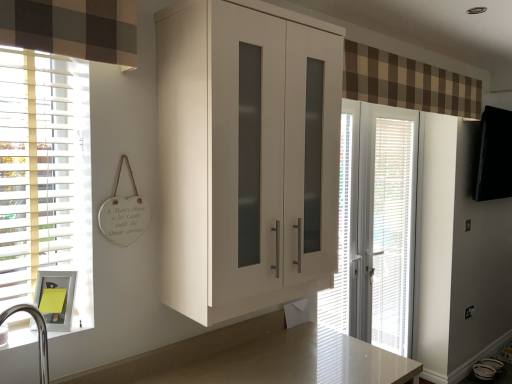
Question: Considering the relative sizes of white glossy door at center and white glossy medicine cabinet at lower left in the image provided, is white glossy door at center wider than white glossy medicine cabinet at lower left?

Choices:
 (A) no
 (B) yes

Answer: (A)

Question: Is white glossy door at center aimed at white glossy medicine cabinet at lower left?

Choices:
 (A) no
 (B) yes

Answer: (A)

Question: From a real-world perspective, is white glossy door at center located higher than white glossy medicine cabinet at lower left?

Choices:
 (A) no
 (B) yes

Answer: (A)

Question: Does white glossy door at center touch white glossy medicine cabinet at lower left?

Choices:
 (A) yes
 (B) no

Answer: (B)

Question: From the image's perspective, is white glossy door at center on white glossy medicine cabinet at lower left?

Choices:
 (A) yes
 (B) no

Answer: (B)

Question: Are white glossy door at center and white glossy medicine cabinet at lower left located far from each other?

Choices:
 (A) no
 (B) yes

Answer: (B)

Question: Is white glossy cabinet at center located outside white glossy door at center?

Choices:
 (A) yes
 (B) no

Answer: (A)

Question: Considering the relative positions of white glossy cabinet at center and white glossy door at center in the image provided, is white glossy cabinet at center to the right of white glossy door at center from the viewer's perspective?

Choices:
 (A) no
 (B) yes

Answer: (A)

Question: Considering the relative positions of white glossy cabinet at center and white glossy door at center in the image provided, is white glossy cabinet at center to the left of white glossy door at center from the viewer's perspective?

Choices:
 (A) yes
 (B) no

Answer: (A)

Question: Can you confirm if white glossy cabinet at center is wider than white glossy door at center?

Choices:
 (A) yes
 (B) no

Answer: (A)

Question: Can you confirm if white glossy cabinet at center is taller than white glossy door at center?

Choices:
 (A) no
 (B) yes

Answer: (A)

Question: Is white glossy cabinet at center not near white glossy door at center?

Choices:
 (A) no
 (B) yes

Answer: (B)

Question: Can brown checkered fabric at upper center be found inside white glossy cabinet at center?

Choices:
 (A) no
 (B) yes

Answer: (A)